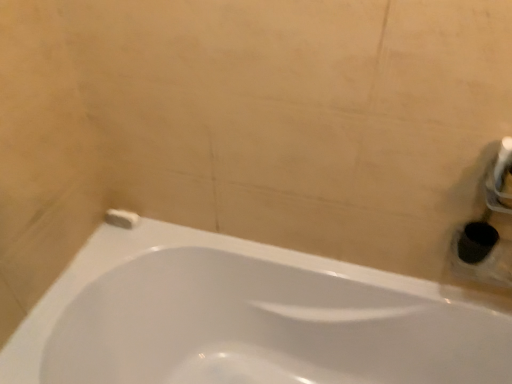
Question: Considering the relative positions of white matte toilet paper at lower left and white glossy bathtub at lower left in the image provided, is white matte toilet paper at lower left in front of white glossy bathtub at lower left?

Choices:
 (A) no
 (B) yes

Answer: (A)

Question: Does white matte toilet paper at lower left have a smaller size compared to white glossy bathtub at lower left?

Choices:
 (A) no
 (B) yes

Answer: (B)

Question: Is white matte toilet paper at lower left far from white glossy bathtub at lower left?

Choices:
 (A) yes
 (B) no

Answer: (B)

Question: Is white matte toilet paper at lower left positioned with its back to white glossy bathtub at lower left?

Choices:
 (A) yes
 (B) no

Answer: (B)

Question: Is white matte toilet paper at lower left positioned behind white glossy bathtub at lower left?

Choices:
 (A) no
 (B) yes

Answer: (B)

Question: Is white matte toilet paper at lower left aimed at white glossy bathtub at lower left?

Choices:
 (A) yes
 (B) no

Answer: (B)

Question: Does white glossy bathtub at lower left have a smaller size compared to white matte toilet paper at lower left?

Choices:
 (A) yes
 (B) no

Answer: (B)

Question: Does white glossy bathtub at lower left appear on the left side of white matte toilet paper at lower left?

Choices:
 (A) no
 (B) yes

Answer: (A)

Question: Does white glossy bathtub at lower left lie behind white matte toilet paper at lower left?

Choices:
 (A) no
 (B) yes

Answer: (A)

Question: Considering the relative sizes of white glossy bathtub at lower left and white matte toilet paper at lower left in the image provided, is white glossy bathtub at lower left taller than white matte toilet paper at lower left?

Choices:
 (A) no
 (B) yes

Answer: (B)

Question: Is white glossy bathtub at lower left oriented towards white matte toilet paper at lower left?

Choices:
 (A) no
 (B) yes

Answer: (A)

Question: Considering the relative sizes of white glossy bathtub at lower left and white matte toilet paper at lower left in the image provided, is white glossy bathtub at lower left shorter than white matte toilet paper at lower left?

Choices:
 (A) no
 (B) yes

Answer: (A)

Question: Looking at their shapes, would you say white glossy bathtub at lower left is wider or thinner than white matte toilet paper at lower left?

Choices:
 (A) wide
 (B) thin

Answer: (A)